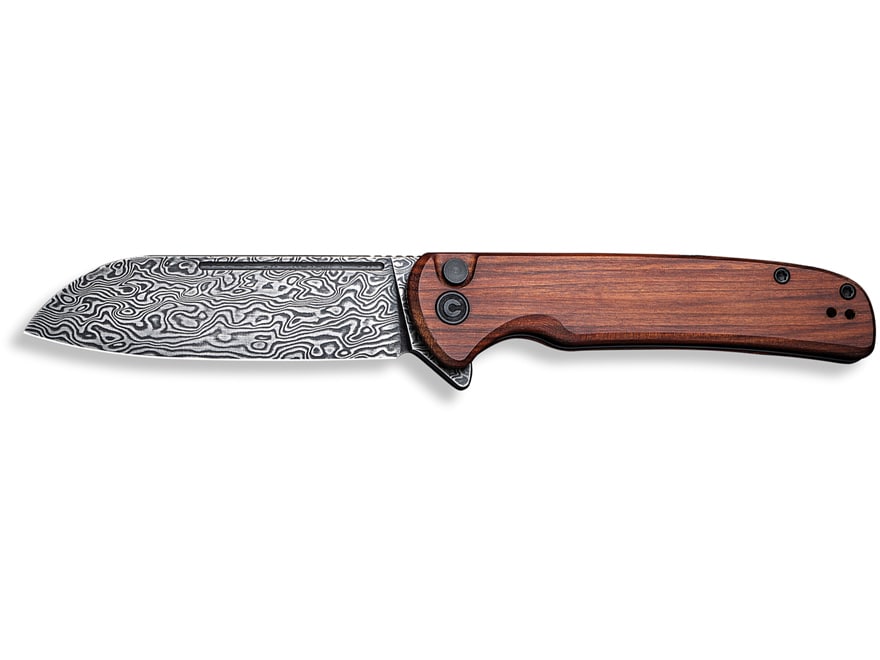
I want to click on top of handle, so click(x=642, y=253).